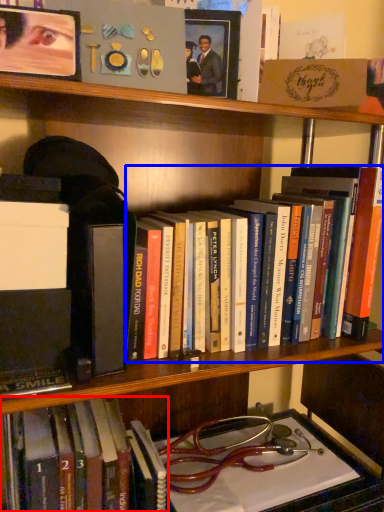
Question: Which point is further to the camera, book (highlighted by a red box) or book (highlighted by a blue box)?

Choices:
 (A) book
 (B) book

Answer: (A)